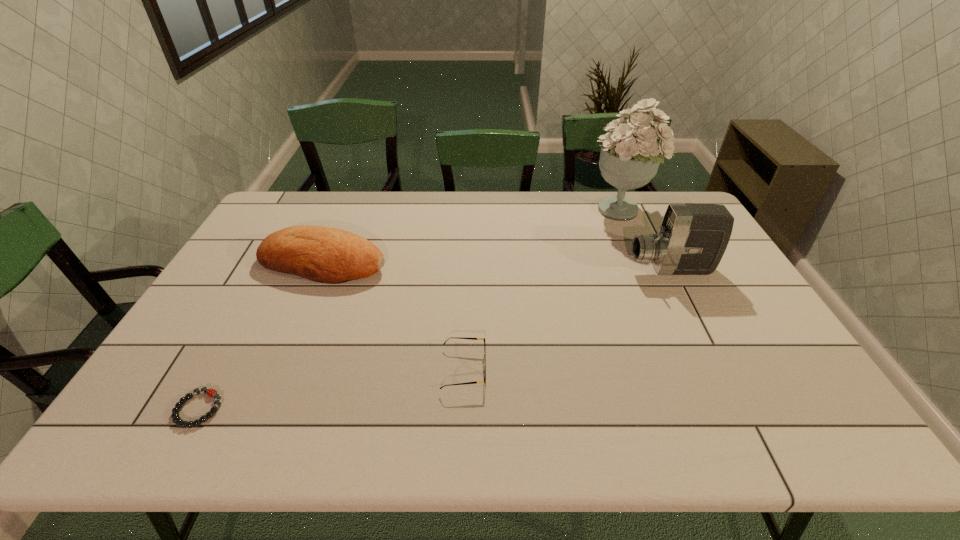
The width and height of the screenshot is (960, 540). Find the location of `bouquet`. bouquet is located at coordinates (630, 156).

Locate an element on the screen. The height and width of the screenshot is (540, 960). the tallest object is located at coordinates (630, 156).

Identify the location of the second tallest object. (692, 239).

Find the location of a particular element. This screenshot has height=540, width=960. bread is located at coordinates (322, 254).

Image resolution: width=960 pixels, height=540 pixels. I want to click on spectacles, so click(476, 382).

Identify the location of the third object from left to right. (476, 382).

Where is `the shortest object`? This screenshot has width=960, height=540. the shortest object is located at coordinates (210, 392).

Locate an element on the screen. This screenshot has width=960, height=540. vacant position located 0.190m on the front of the tallest object is located at coordinates (645, 265).

Locate an element on the screen. vacant space situated at the front of the fourth shortest object, highlighting the lens is located at coordinates (502, 269).

Where is `vacant space situated at the front of the fourth shortest object, highlighting the lens`? vacant space situated at the front of the fourth shortest object, highlighting the lens is located at coordinates (580, 269).